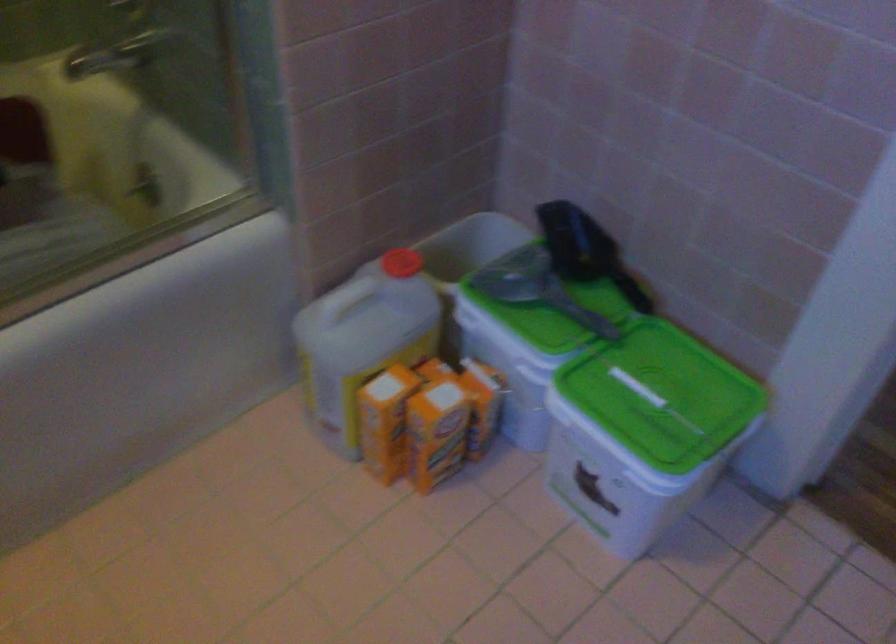
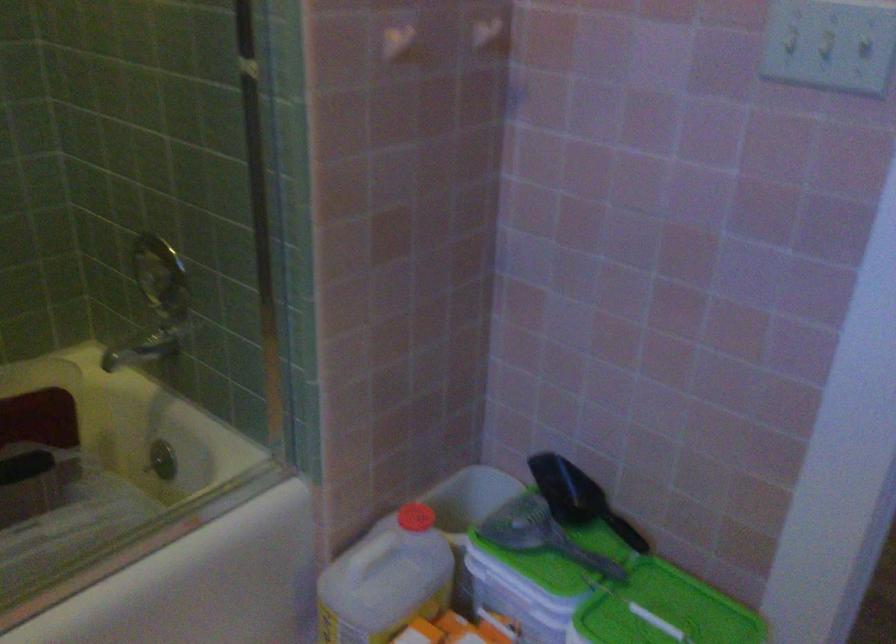
Find the pixel in the second image that matches (x=640, y=392) in the first image.

(656, 621)